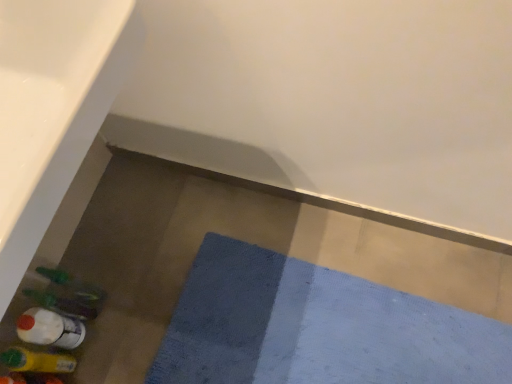
Question: From the image's perspective, relative to translucent plastic bottle at lower left, marked as the 1th bottle in a bottom-to-top arrangement, is translucent plastic bottle at lower left, the 3th bottle positioned from the bottom, above or below?

Choices:
 (A) above
 (B) below

Answer: (A)

Question: From a real-world perspective, relative to translucent plastic bottle at lower left, marked as the 1th bottle in a bottom-to-top arrangement, is translucent plastic bottle at lower left, the 3th bottle positioned from the bottom, vertically above or below?

Choices:
 (A) above
 (B) below

Answer: (B)

Question: Which is farther from the translucent plastic bottle at lower left, which is the second bottle from top to bottom?

Choices:
 (A) blue textured bath mat at lower center
 (B) white glossy bath at lower left
 (C) translucent plastic bottle at lower left, which ranks as the 3th bottle in top-to-bottom order
 (D) translucent plastic bottle at lower left, arranged as the first bottle when viewed from the top

Answer: (B)

Question: Which object is positioned farthest from the white glossy bath at lower left?

Choices:
 (A) translucent plastic bottle at lower left, which is the second bottle from top to bottom
 (B) blue textured bath mat at lower center
 (C) translucent plastic bottle at lower left, marked as the 1th bottle in a bottom-to-top arrangement
 (D) translucent plastic bottle at lower left, arranged as the first bottle when viewed from the top

Answer: (B)